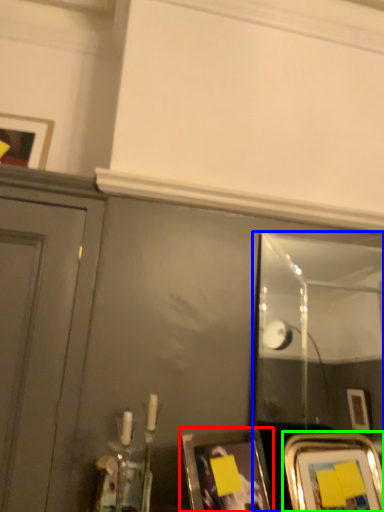
Question: Which object is the closest to the picture frame (highlighted by a red box)? Choose among these: mirror (highlighted by a blue box) or picture frame (highlighted by a green box).

Choices:
 (A) mirror
 (B) picture frame

Answer: (B)